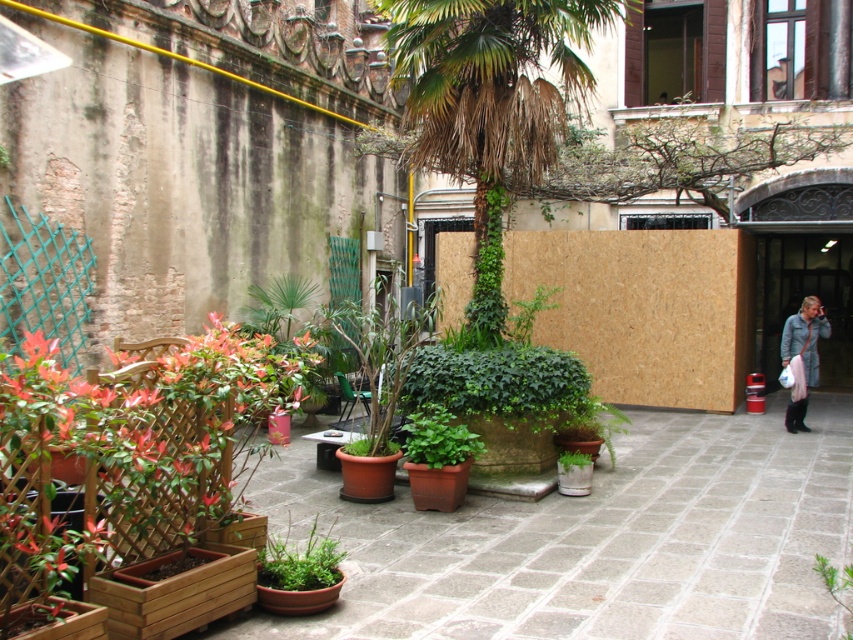
You are organizing a small event in the courtyard and need to place a 1.2 meter tall decoration. The decoration must be placed where there is enough vertical space. Given the green matte plant at center and the light gray fabric coat at right, which object should you place the decoration next to to ensure it doesn

The light gray fabric coat at right is taller than the green matte plant at center. Since the decoration is 1.2 meters tall, placing it next to the light gray fabric coat at right would provide sufficient vertical space as the coat is taller than the plant.

Looking at this image, you are designing a garden layout and need to place a small bench between the green leafy palm tree at center and the green matte plant at center. Since the palm tree is bigger, which side of the bench should face the larger plant to ensure balance?

The bench should face the green leafy palm tree at center because it is larger, creating a balanced arrangement by positioning the bench closer to the smaller green matte plant at center.